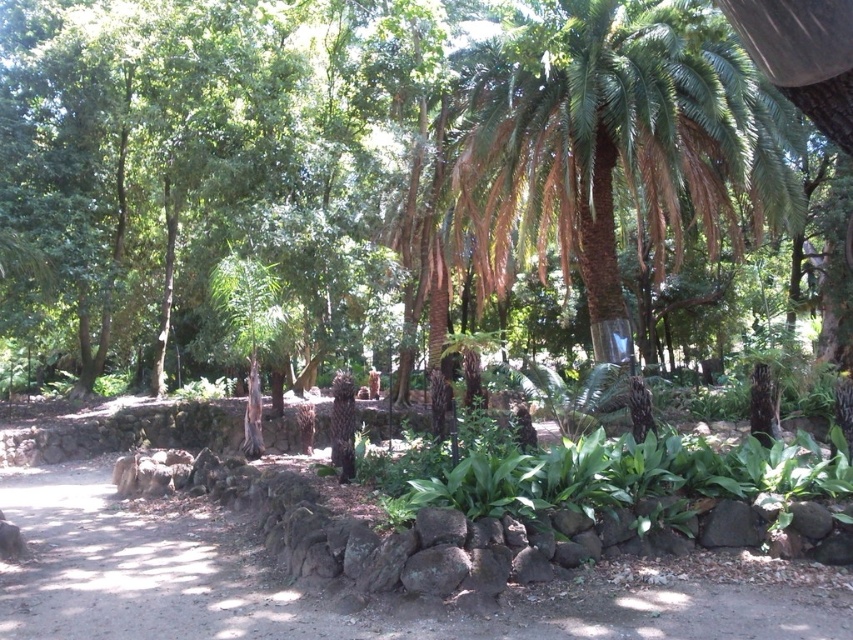
You are a gardener standing on the dirt path at center and looking towards the green leafy palm at upper right. Which direction should you walk to get closer to the palm?

The green leafy palm at upper right is above the dirt path at center, so you should walk forward towards the palm to get closer.

You are a gardener planning to plant a new row of flowers along the dirt path at center. Considering the space occupied by the green leafy palm at upper right, will the palm be a problem for the flower bed width?

The green leafy palm at upper right has a lesser width compared to the dirt path at center, so it will not be a problem for the flower bed width as there is sufficient space.